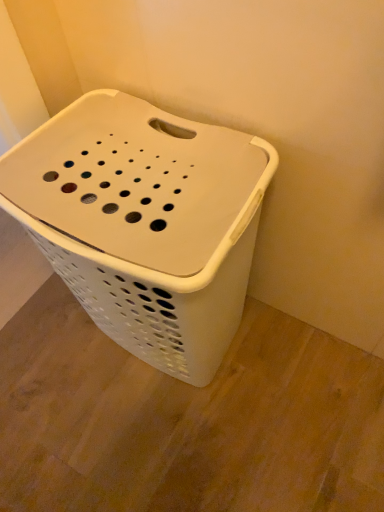
In order to click on vacant area to the right of white plastic laundry basket at center in this screenshot , I will do `click(308, 370)`.